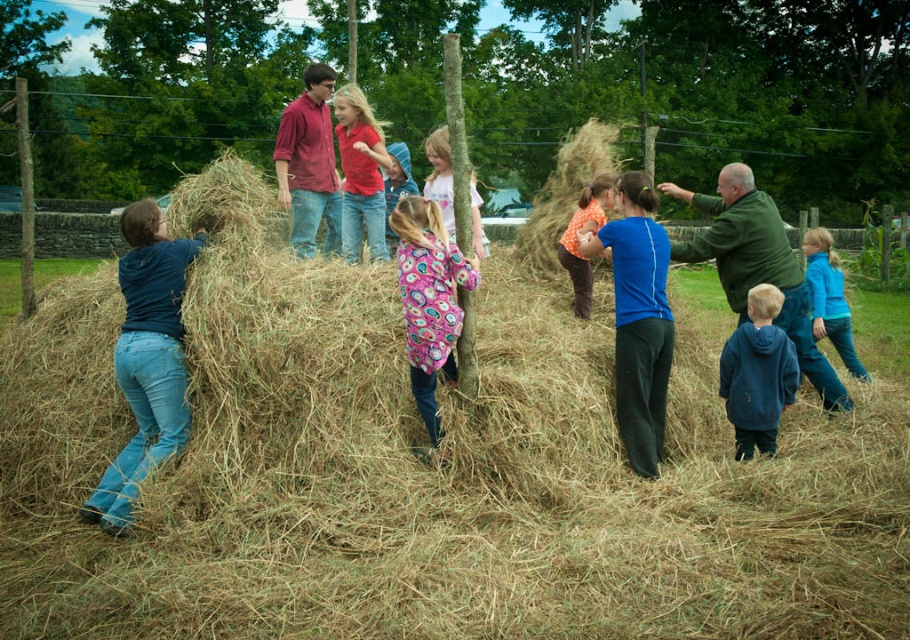
Can you confirm if orange dotted shirt at center is positioned to the right of blue fleece jacket at right?

In fact, orange dotted shirt at center is to the left of blue fleece jacket at right.

Is point (634, 284) more distant than point (811, 230)?

That is False.

Is point (579, 248) closer to camera compared to point (807, 296)?

Yes.

Where is `orange dotted shirt at center`? Image resolution: width=910 pixels, height=640 pixels. orange dotted shirt at center is located at coordinates (638, 317).

Is green matte jacket at upper right in front of matte red shirt at center?

Yes.

Which is in front, point (797, 353) or point (347, 244)?

Point (797, 353)

Where is `green matte jacket at upper right`? This screenshot has width=910, height=640. green matte jacket at upper right is located at coordinates (756, 266).

Which is in front, point (772, 266) or point (420, 397)?

Positioned in front is point (420, 397).

Between green matte jacket at upper right and floral-patterned fleece jacket at center, which one is positioned higher?

green matte jacket at upper right

The height and width of the screenshot is (640, 910). What do you see at coordinates (756, 266) in the screenshot?
I see `green matte jacket at upper right` at bounding box center [756, 266].

At what (x,y) coordinates should I click in order to perform the action: click on green matte jacket at upper right. Please return your answer as a coordinate pair (x, y). Looking at the image, I should click on coord(756,266).